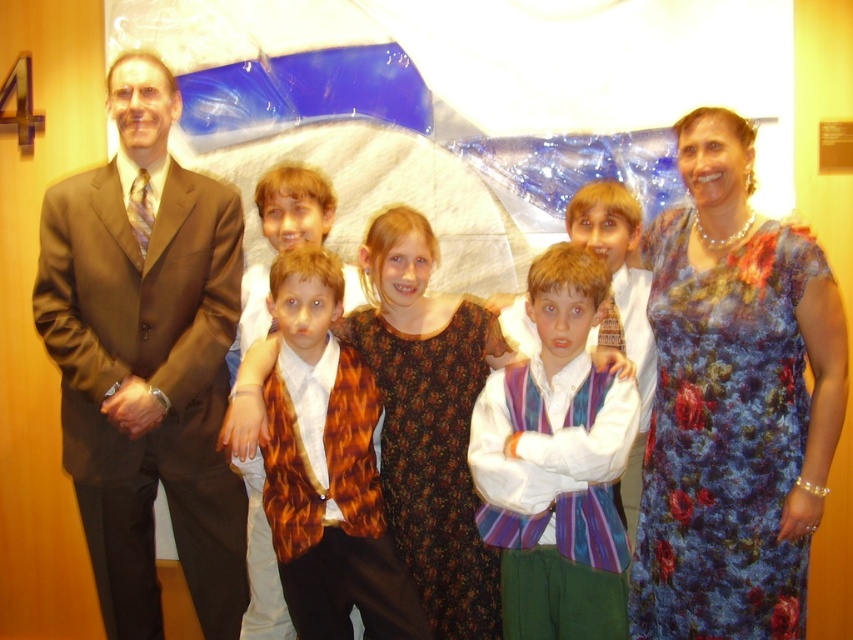
You are a photographer adjusting the camera settings for a group photo. The scene includes a brown suit at left and a striped velvet vest at center. Which object should you focus on first if you need to prioritize the larger subject?

The brown suit at left is bigger than the striped velvet vest at center, so you should focus on the brown suit at left first.